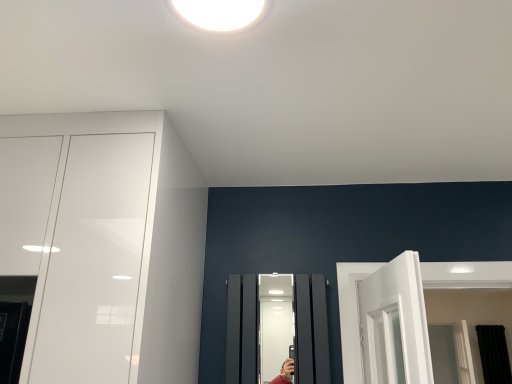
Describe the element at coordinates (219, 13) in the screenshot. I see `white glossy light fixture at upper center` at that location.

The width and height of the screenshot is (512, 384). Identify the location of white glossy light fixture at upper center. (219, 13).

Measure the distance between white glossy light fixture at upper center and camera.

The distance of white glossy light fixture at upper center from camera is 33.39 inches.

Where is `white glossy light fixture at upper center`? The height and width of the screenshot is (384, 512). white glossy light fixture at upper center is located at coordinates (219, 13).